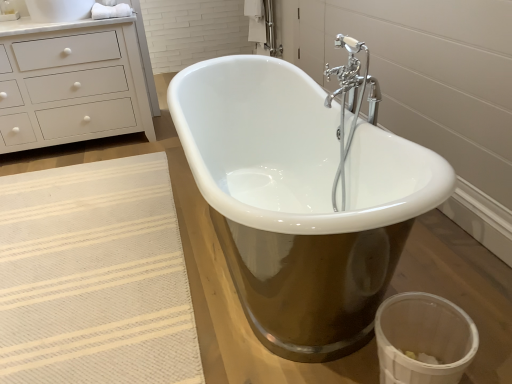
Locate an element on the screen. The width and height of the screenshot is (512, 384). free space above beige woven rug at lower left (from a real-world perspective) is located at coordinates (79, 261).